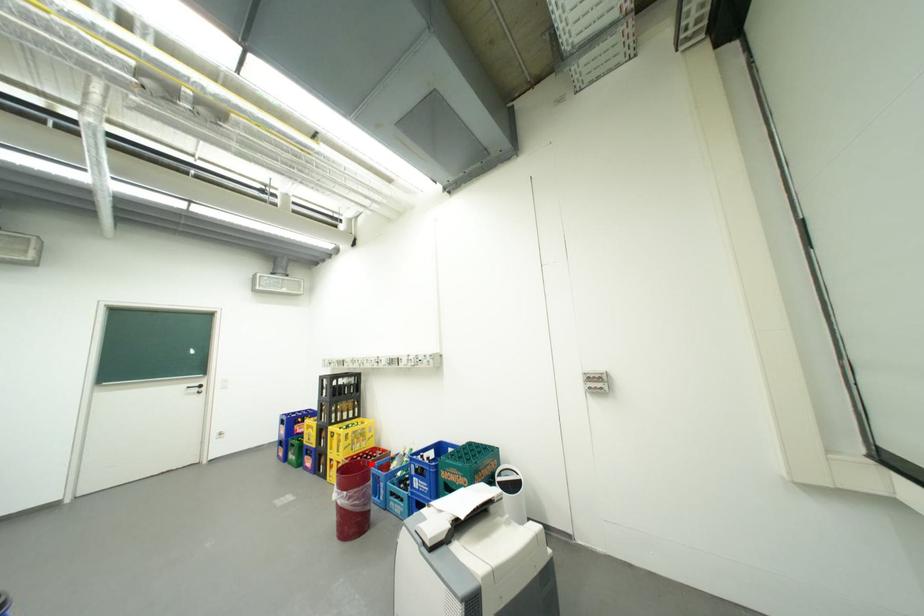
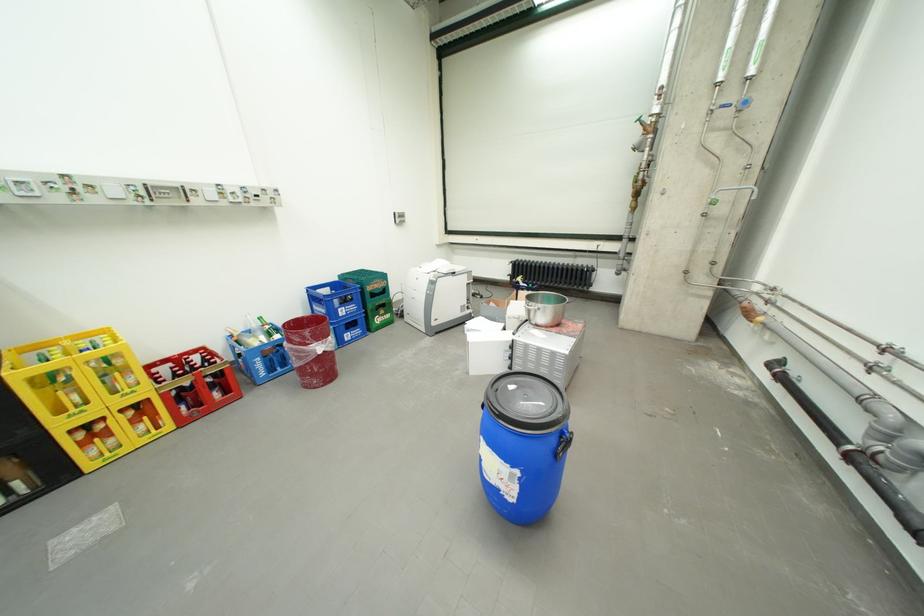
Question: I am providing you with two images of the same scene from different viewpoints. A red point is marked on the first image. Is the red point's position out of view in image 2?

Choices:
 (A) Yes
 (B) No

Answer: (B)